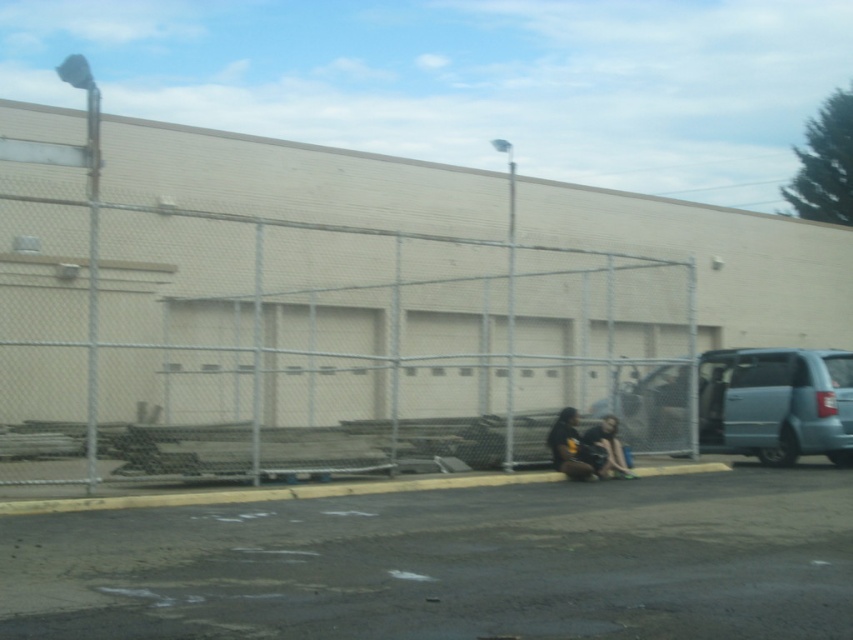
Question: Considering the relative positions of metallic chain-link fence at center and dark gray fabric squat at lower right in the image provided, where is metallic chain-link fence at center located with respect to dark gray fabric squat at lower right?

Choices:
 (A) left
 (B) right

Answer: (A)

Question: Which object is positioned farthest from the black matte shirt at center?

Choices:
 (A) dark gray fabric squat at lower right
 (B) gray concrete curb at lower center

Answer: (B)

Question: Does gray concrete curb at lower center lie in front of black matte shirt at center?

Choices:
 (A) no
 (B) yes

Answer: (B)

Question: Considering the relative positions of metallic chain-link fence at center and dark gray fabric squat at lower right in the image provided, where is metallic chain-link fence at center located with respect to dark gray fabric squat at lower right?

Choices:
 (A) left
 (B) right

Answer: (A)

Question: Which object is positioned farthest from the black matte shirt at center?

Choices:
 (A) metallic chain-link fence at center
 (B) dark gray fabric squat at lower right
 (C) gray concrete curb at lower center

Answer: (A)

Question: Considering the real-world distances, which object is closest to the dark gray fabric squat at lower right?

Choices:
 (A) gray concrete curb at lower center
 (B) metallic chain-link fence at center

Answer: (A)